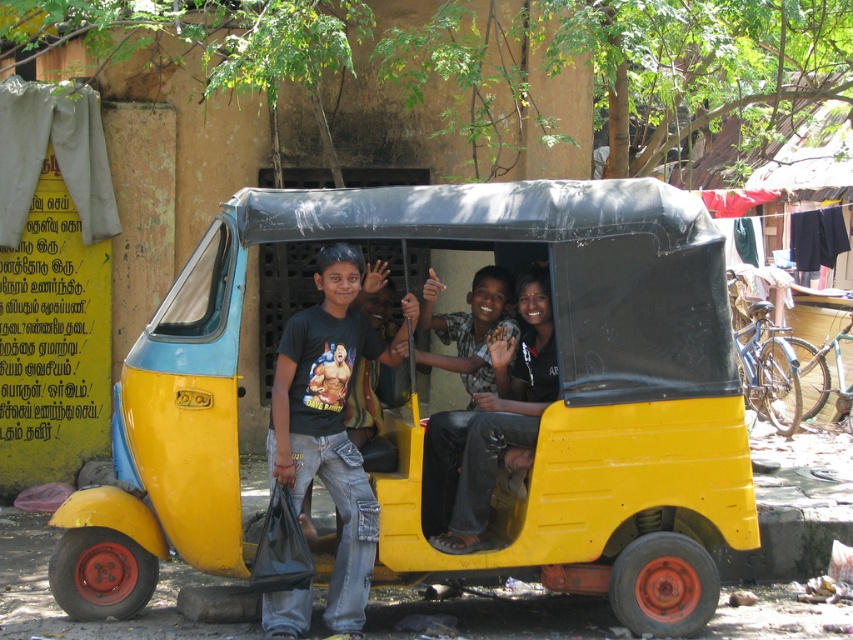
Question: In this image, where is yellow matte tricycle at center located relative to black t-shirt at center?

Choices:
 (A) left
 (B) right

Answer: (B)

Question: Which point is closer to the camera?

Choices:
 (A) (671, 460)
 (B) (352, 593)
 (C) (538, 296)

Answer: (B)

Question: Which object appears closest to the camera in this image?

Choices:
 (A) black t-shirt at center
 (B) yellow matte tricycle at center

Answer: (B)

Question: Does yellow matte tricycle at center have a greater width compared to matte black shirt at center?

Choices:
 (A) no
 (B) yes

Answer: (B)

Question: Is black t-shirt at center behind matte black shirt at center?

Choices:
 (A) yes
 (B) no

Answer: (B)

Question: Which object is the farthest from the black t-shirt at center?

Choices:
 (A) yellow matte tricycle at center
 (B) matte black shirt at center

Answer: (B)